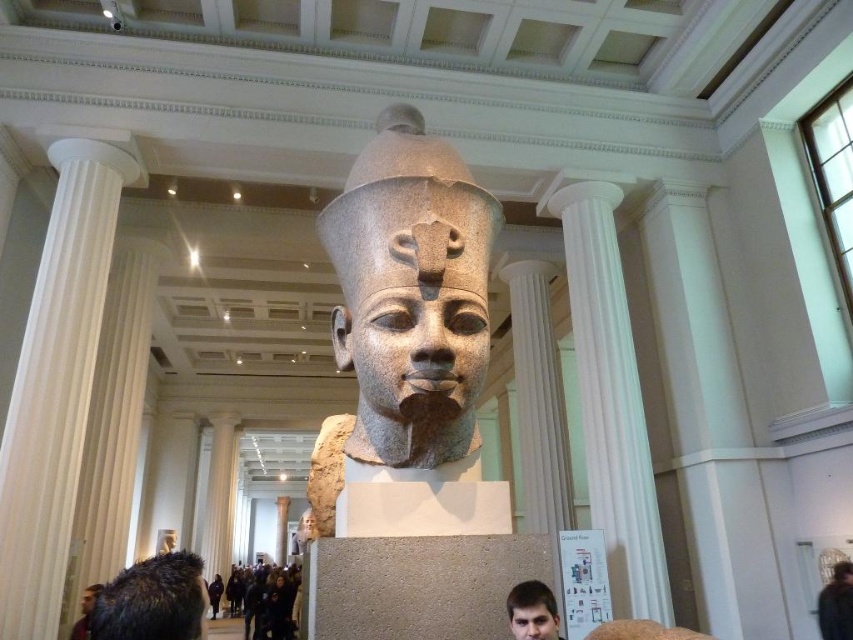
Question: Which of these objects is positioned closest to the black fuzzy head at lower left?

Choices:
 (A) matte gray stone head at center
 (B) white marble column at left
 (C) white marble column at center
 (D) matte stone head at center

Answer: (A)

Question: Among these points, which one is farthest from the camera?

Choices:
 (A) (654, 518)
 (B) (378, 460)
 (C) (86, 602)

Answer: (C)

Question: Does white marble column at center come behind matte gray stone head at center?

Choices:
 (A) yes
 (B) no

Answer: (A)

Question: Is white marble column at left to the right of white marble column at center from the viewer's perspective?

Choices:
 (A) yes
 (B) no

Answer: (B)

Question: Which object is the closest to the matte stone head at center?

Choices:
 (A) white marble column at left
 (B) matte gray stone head at center

Answer: (A)

Question: From the image, what is the correct spatial relationship of white marble column at left in relation to matte gray stone head at center?

Choices:
 (A) right
 (B) left

Answer: (B)